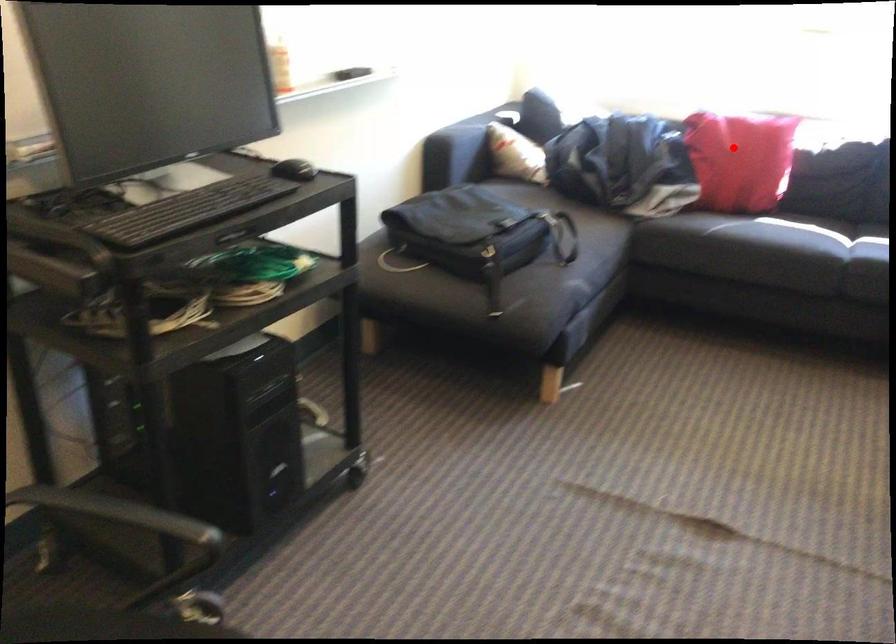
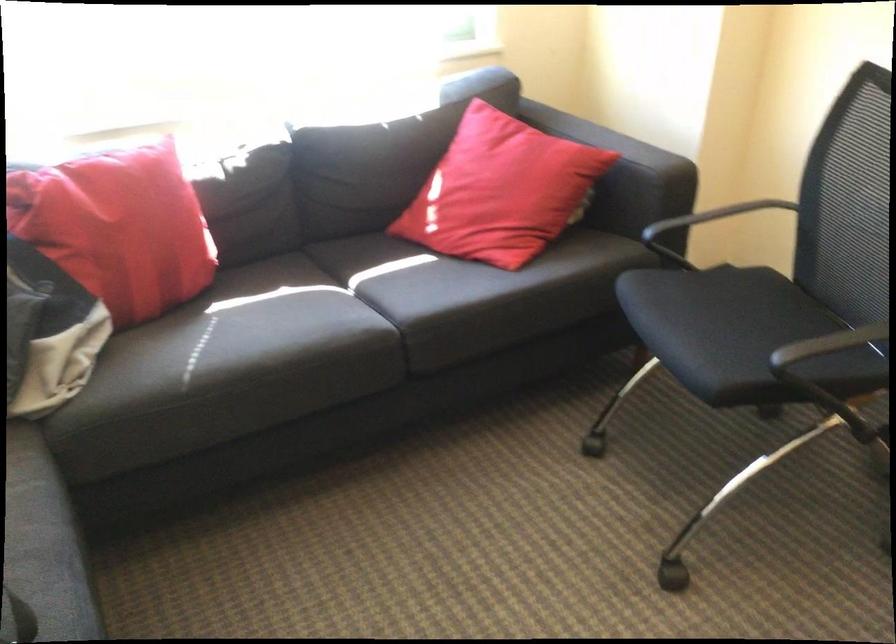
The point at the highlighted location is marked in the first image. Where is the corresponding point in the second image?

(117, 228)